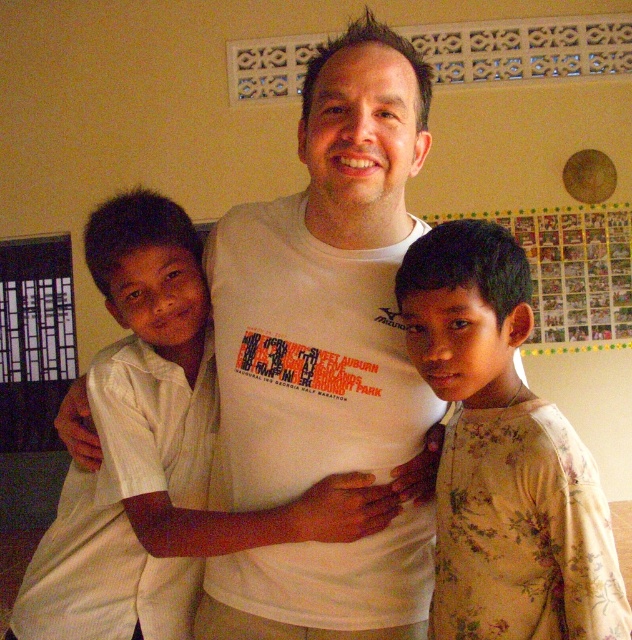
Based on the photo, does white cotton t-shirt at center have a smaller size compared to floral cotton shirt at right?

No, white cotton t-shirt at center is not smaller than floral cotton shirt at right.

Does white cotton t-shirt at center have a larger size compared to floral cotton shirt at right?

Yes, white cotton t-shirt at center is bigger than floral cotton shirt at right.

Is point (284, 456) positioned behind point (553, 512)?

Yes.

This screenshot has height=640, width=632. What are the coordinates of `white cotton t-shirt at center` in the screenshot? It's located at pyautogui.click(x=327, y=356).